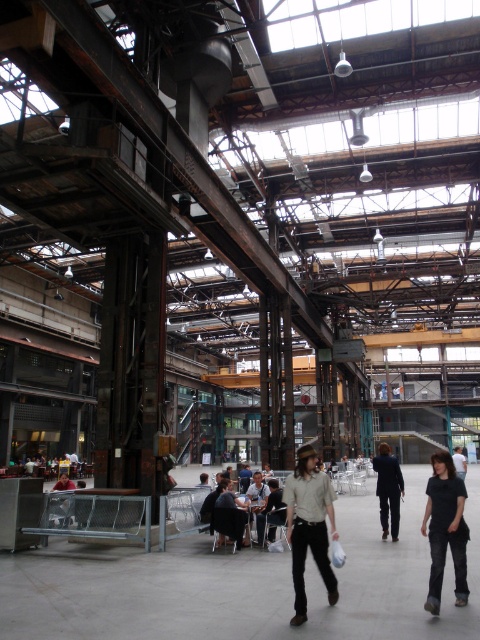
Question: Which object appears closest to the camera in this image?

Choices:
 (A) khaki cotton shirt at center
 (B) dark blue suit at center

Answer: (A)

Question: Among these points, which one is nearest to the camera?

Choices:
 (A) (397, 477)
 (B) (457, 465)

Answer: (A)

Question: Is black cotton shirt at lower right to the left of dark blue suit at center from the viewer's perspective?

Choices:
 (A) yes
 (B) no

Answer: (B)

Question: Which point is closer to the camera taking this photo?

Choices:
 (A) (437, 582)
 (B) (324, 579)
 (C) (66, 477)
 (D) (454, 458)

Answer: (A)

Question: Considering the relative positions of dark blue suit at center and light gray fabric bag at lower left in the image provided, where is dark blue suit at center located with respect to light gray fabric bag at lower left?

Choices:
 (A) right
 (B) left

Answer: (A)

Question: Can you confirm if black cotton shirt at lower right is positioned to the right of dark brown leather jacket at center?

Choices:
 (A) yes
 (B) no

Answer: (B)